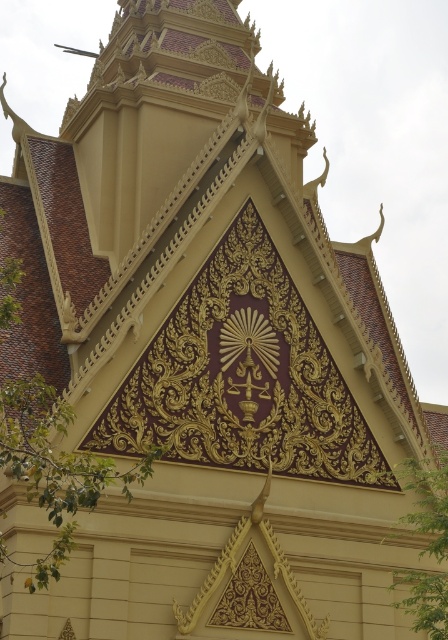
Question: Does green leafy tree at center appear on the left side of green leafy tree at lower right?

Choices:
 (A) no
 (B) yes

Answer: (B)

Question: Is the position of green leafy tree at center less distant than that of green leafy tree at lower right?

Choices:
 (A) no
 (B) yes

Answer: (B)

Question: In this image, where is green leafy tree at center located relative to green leafy tree at lower right?

Choices:
 (A) above
 (B) below

Answer: (A)